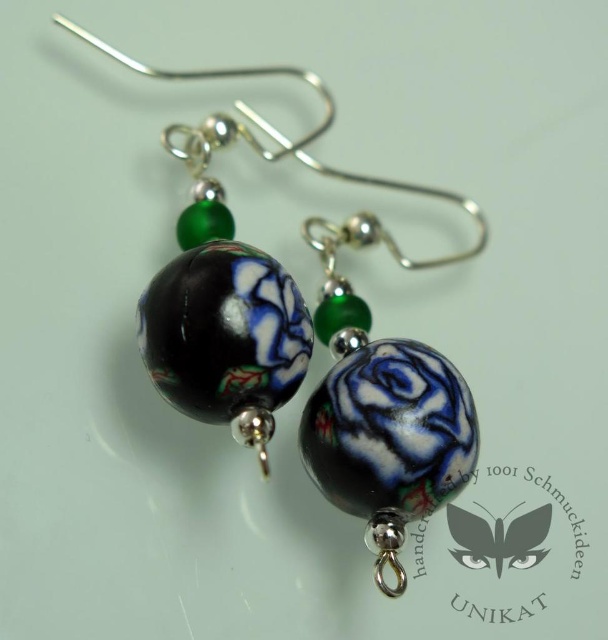
Based on the photo, between matte black ceramic rose at center and matte black glass rose at center, which one appears on the right side from the viewer's perspective?

Positioned to the right is matte black glass rose at center.

Which of these two, matte black ceramic rose at center or matte black glass rose at center, stands shorter?

Standing shorter between the two is matte black glass rose at center.

Who is more distant from viewer, (306, 460) or (390, 356)?

The point (306, 460) is behind.

The width and height of the screenshot is (608, 640). I want to click on matte black ceramic rose at center, so [356, 352].

Which of these two, matte black glass rose at center or black glossy swirl at center, stands shorter?

black glossy swirl at center

Is the position of matte black glass rose at center more distant than that of black glossy swirl at center?

No, it is in front of black glossy swirl at center.

Does point (382, 522) come closer to viewer compared to point (523, 541)?

Yes, it is in front of point (523, 541).

This screenshot has width=608, height=640. In order to click on matte black glass rose at center in this screenshot , I will do `click(381, 410)`.

Does matte black ceramic rose at center have a lesser width compared to black glossy swirl at center?

In fact, matte black ceramic rose at center might be wider than black glossy swirl at center.

Does matte black ceramic rose at center have a lesser height compared to black glossy swirl at center?

No, matte black ceramic rose at center is not shorter than black glossy swirl at center.

The width and height of the screenshot is (608, 640). Describe the element at coordinates (356, 352) in the screenshot. I see `matte black ceramic rose at center` at that location.

You are a GUI agent. You are given a task and a screenshot of the screen. Output one action in this format:
    pyautogui.click(x=<x>, y=<y>)
    Task: Click on the matte black ceramic rose at center
    
    Given the screenshot: What is the action you would take?
    pyautogui.click(x=356, y=352)